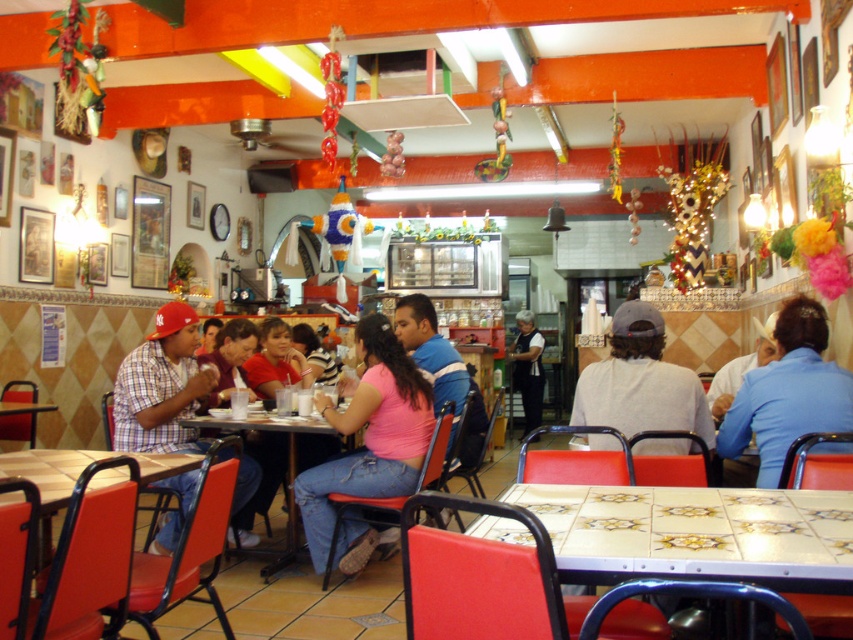
Which is behind, point (202, 369) or point (519, 346)?

The point (519, 346) is behind.

Is plaid cotton shirt at left smaller than dark blue shirt at center?

Incorrect, plaid cotton shirt at left is not smaller in size than dark blue shirt at center.

The width and height of the screenshot is (853, 640). I want to click on plaid cotton shirt at left, so click(163, 387).

Can you confirm if pink matte shirt at center is wider than matte pink shirt at center?

Indeed, pink matte shirt at center has a greater width compared to matte pink shirt at center.

Which is above, pink matte shirt at center or matte pink shirt at center?

matte pink shirt at center is above.

Who is more forward, (308, 500) or (254, 369)?

Point (308, 500) is more forward.

Locate an element on the screen. The width and height of the screenshot is (853, 640). pink matte shirt at center is located at coordinates [367, 445].

How distant is metallic red table at lower left from plaid cotton shirt at left?

1.03 meters

Is metallic red table at lower left to the left of plaid cotton shirt at left from the viewer's perspective?

In fact, metallic red table at lower left is to the right of plaid cotton shirt at left.

Is point (100, 609) positioned after point (154, 317)?

That is False.

Locate an element on the screen. The image size is (853, 640). metallic red table at lower left is located at coordinates (91, 516).